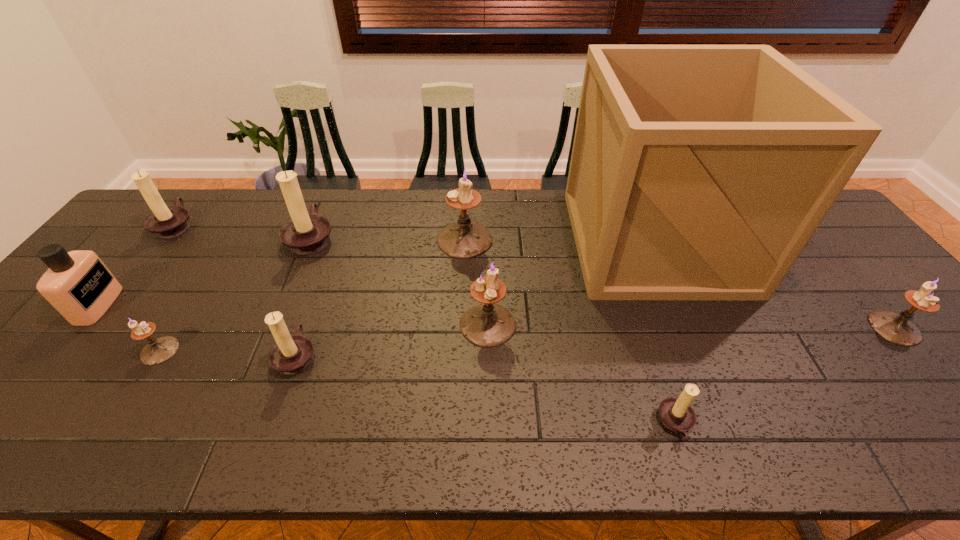
Find the location of a particular element. free spot between the third smallest brown candle holder and the box is located at coordinates (415, 233).

Find the location of a particular element. free space that is in between the biggest brown candle holder and the farthest purple candle holder is located at coordinates (388, 239).

What are the coordinates of `free area in between the seventh candle holder from left to right and the third smallest purple candle holder` in the screenshot? It's located at (582, 374).

Locate an element on the screen. The image size is (960, 540). empty location between the rightmost brown candle holder and the beige perfume is located at coordinates (387, 364).

Locate an element on the screen. The height and width of the screenshot is (540, 960). vacant point located between the rightmost brown candle holder and the third biggest purple candle holder is located at coordinates (785, 376).

Where is `vacant area that lies between the eighth object from right to left and the perfume`? vacant area that lies between the eighth object from right to left and the perfume is located at coordinates (129, 328).

You are a GUI agent. You are given a task and a screenshot of the screen. Output one action in this format:
    pyautogui.click(x=<x>, y=<y>)
    Task: Click on the vacant area between the box and the smallest brown candle holder
    The image size is (960, 540).
    Given the screenshot: What is the action you would take?
    pos(665,332)

Locate which object is the second closest to the nearest brown candle holder. Please provide its 2D coordinates. Your answer should be formatted as a tuple, i.e. [(x, y)], where the tuple contains the x and y coordinates of a point satisfying the conditions above.

[(486, 325)]

Select which object appears as the fifth closest to the biggest purple candle holder. Please provide its 2D coordinates. Your answer should be formatted as a tuple, i.e. [(x, y)], where the tuple contains the x and y coordinates of a point satisfying the conditions above.

[(676, 414)]

Identify the location of the sixth closest candle holder relative to the third smallest purple candle holder. (166, 222).